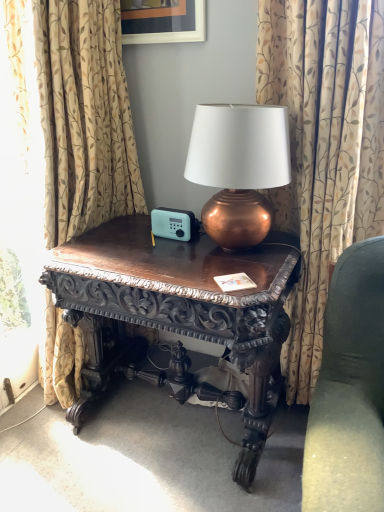
I want to click on vacant space situated on the left part of copper metallic lamp at center, so click(x=152, y=253).